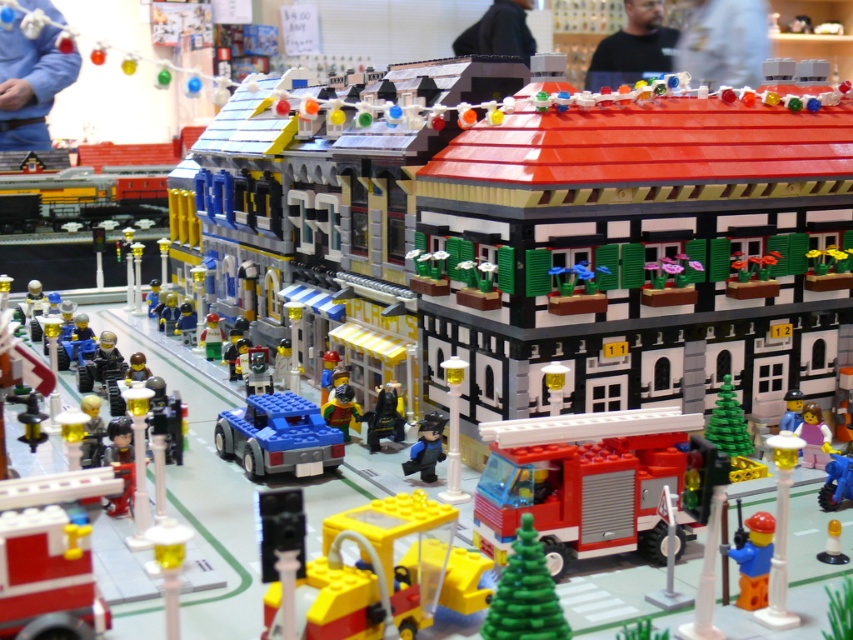
Question: Among these points, which one is farthest from the camera?

Choices:
 (A) (799, 394)
 (B) (212, 358)

Answer: (B)

Question: Is brick red fire truck at center wider than green matte minifigure at center?

Choices:
 (A) no
 (B) yes

Answer: (B)

Question: Does blue plastic car at center lie behind pink matte figure at center?

Choices:
 (A) yes
 (B) no

Answer: (B)

Question: Does green matte christmas tree at center have a smaller size compared to black plastic figure at center?

Choices:
 (A) no
 (B) yes

Answer: (A)

Question: Which object is positioned farthest from the blue matte figure at center?

Choices:
 (A) matte black figure at center
 (B) green matte minifigure at center
 (C) green matte christmas tree at center
 (D) blue plastic minifigure at center

Answer: (B)

Question: Estimate the real-world distances between objects in this image. Which object is farther from the blue plastic car at center?

Choices:
 (A) brick red fire truck at center
 (B) blue plastic toy car at center

Answer: (B)